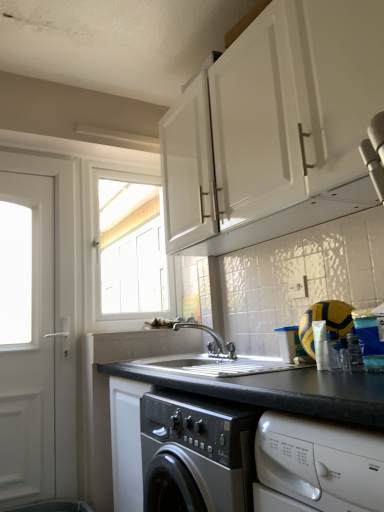
Question: From a real-world perspective, does white matte door at left stand above black granite countertop at center?

Choices:
 (A) yes
 (B) no

Answer: (A)

Question: Does white matte door at left appear on the left side of black granite countertop at center?

Choices:
 (A) yes
 (B) no

Answer: (A)

Question: Is white matte door at left behind black granite countertop at center?

Choices:
 (A) yes
 (B) no

Answer: (A)

Question: Would you say white matte door at left is outside black granite countertop at center?

Choices:
 (A) no
 (B) yes

Answer: (B)

Question: Can you confirm if white matte door at left is taller than black granite countertop at center?

Choices:
 (A) no
 (B) yes

Answer: (B)

Question: Based on their sizes in the image, would you say silver metallic faucet at center is bigger or smaller than white glossy window at upper center?

Choices:
 (A) small
 (B) big

Answer: (A)

Question: Is silver metallic faucet at center inside the boundaries of white glossy window at upper center, or outside?

Choices:
 (A) outside
 (B) inside

Answer: (A)

Question: Is point pos(208,347) closer or farther from the camera than point pos(152,271)?

Choices:
 (A) closer
 (B) farther

Answer: (A)

Question: From a real-world perspective, relative to white glossy window at upper center, is silver metallic faucet at center vertically above or below?

Choices:
 (A) below
 (B) above

Answer: (A)

Question: Considering their positions, is white matte door at left located in front of or behind black granite countertop at center?

Choices:
 (A) front
 (B) behind

Answer: (B)

Question: Based on their sizes in the image, would you say white matte door at left is bigger or smaller than black granite countertop at center?

Choices:
 (A) big
 (B) small

Answer: (B)

Question: From a real-world perspective, is white matte door at left positioned above or below black granite countertop at center?

Choices:
 (A) above
 (B) below

Answer: (A)

Question: Is white matte door at left situated inside black granite countertop at center or outside?

Choices:
 (A) inside
 (B) outside

Answer: (B)

Question: Visually, is black granite countertop at center positioned to the left or to the right of white glossy window at upper center?

Choices:
 (A) right
 (B) left

Answer: (A)

Question: Considering their positions, is black granite countertop at center located in front of or behind white glossy window at upper center?

Choices:
 (A) behind
 (B) front

Answer: (B)